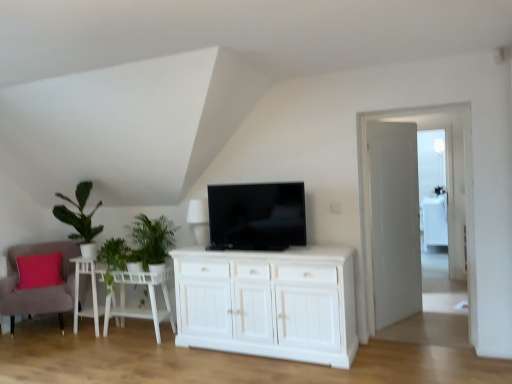
This screenshot has width=512, height=384. What are the coordinates of `vacant space underneath green leafy plant at lower left, placed as the 1th plant when sorted from right to left (from a real-world perspective)` in the screenshot? It's located at (154, 344).